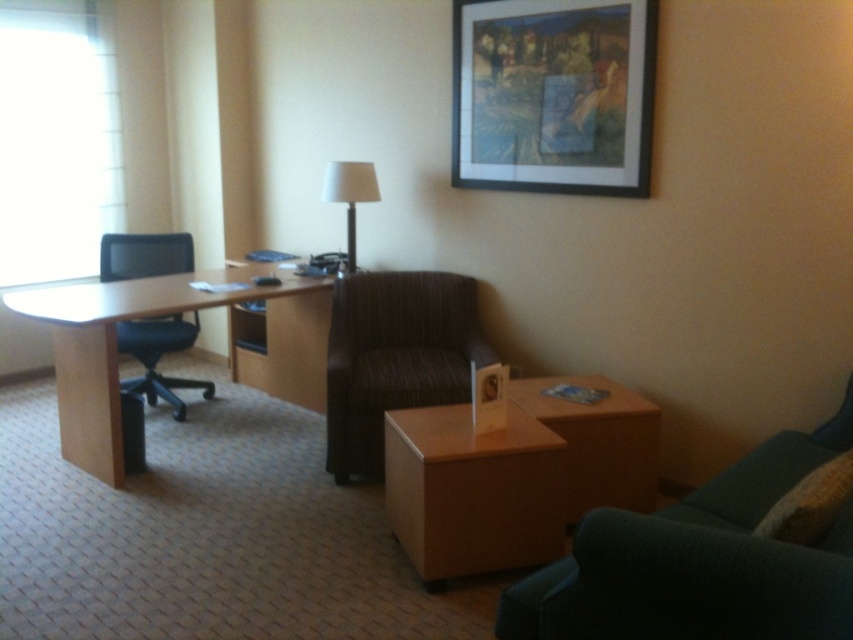
You are standing in the hotel room and want to place a small lamp on the desk. The desk is to the left of the brown striped armchair at center. Where should you place the lamp so it is near the wooden framed artwork at upper center?

Place the lamp on the right side of the desk since the wooden framed artwork at upper center is to the right of the brown striped armchair at center, and the desk is to the left of the armchair. This positioning will align the lamp closer to the artwork.

You are standing in the hotel room and want to pick up an item from the desk. You notice two points on the desk surface labeled as point (76, 438) and point (190, 384). Which point is closer to you when you are facing the desk?

Point (76, 438) is closer to the camera than point (190, 384), so when facing the desk, point (76, 438) is closer to you.